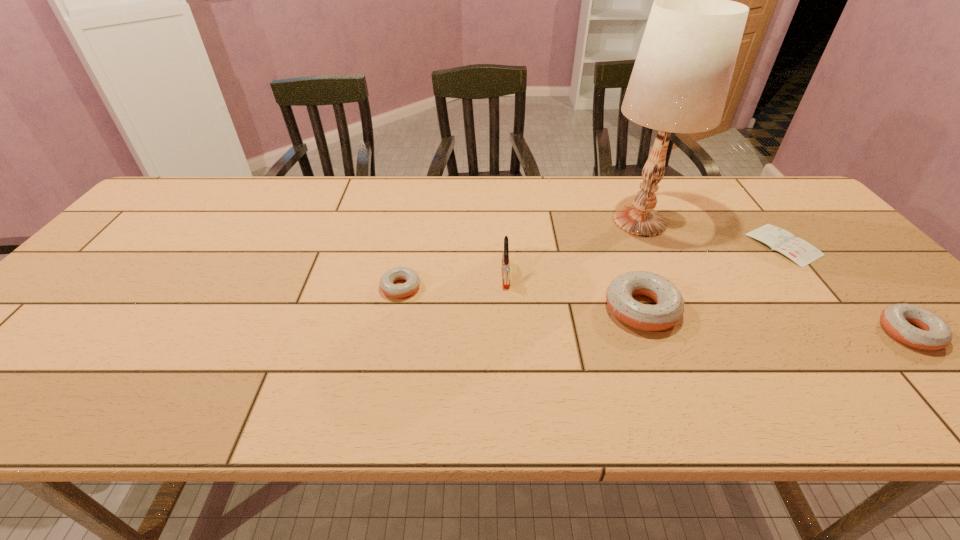
Locate an element on the screen. Image resolution: width=960 pixels, height=540 pixels. object present at the near right corner is located at coordinates (934, 334).

Identify the location of vacant space at the far edge of the desktop. This screenshot has width=960, height=540. (677, 178).

Identify the location of vacant space at the near edge. Image resolution: width=960 pixels, height=540 pixels. (303, 347).

This screenshot has width=960, height=540. Find the location of `vacant space at the left edge of the desktop`. vacant space at the left edge of the desktop is located at coordinates (75, 310).

At what (x,y) coordinates should I click in order to perform the action: click on vacant space at the far left corner of the desktop. Please return your answer as a coordinate pair (x, y). The width and height of the screenshot is (960, 540). Looking at the image, I should click on (154, 205).

In the image, there is a desktop. Identify the location of vacant space at the near left corner. The image size is (960, 540). (72, 358).

In the image, there is a desktop. Where is `free space at the near right corner`? This screenshot has width=960, height=540. free space at the near right corner is located at coordinates (905, 359).

This screenshot has width=960, height=540. I want to click on vacant area that lies between the second tallest object and the tallest doughnut, so point(573,291).

Identify the location of vacant area that lies between the second doughnut from left to right and the stapler. Image resolution: width=960 pixels, height=540 pixels. (573, 291).

The width and height of the screenshot is (960, 540). Find the location of `free space that is in between the tallest object and the third shortest object`. free space that is in between the tallest object and the third shortest object is located at coordinates (775, 277).